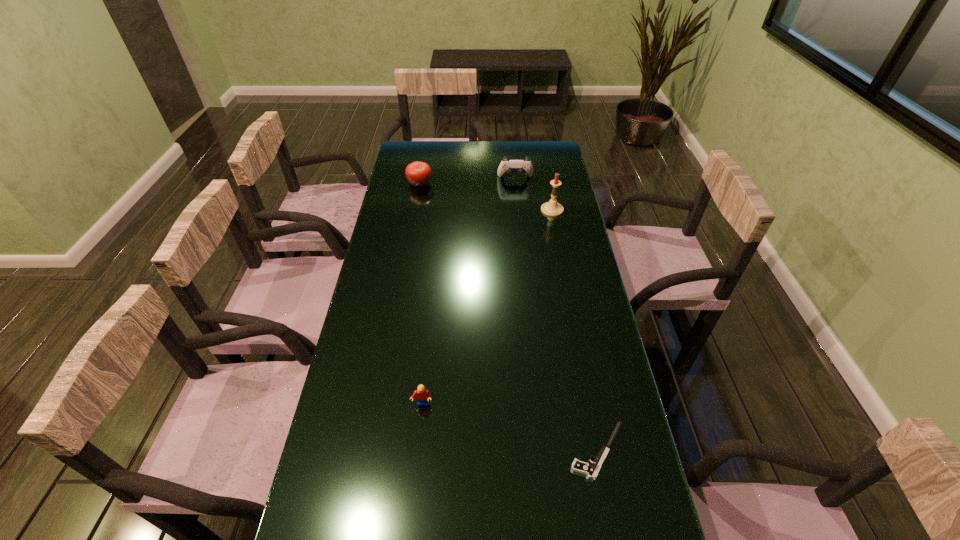
Identify the location of free location located 0.120m on the front-facing side of the control. [x=517, y=199].

Locate an element on the screen. vacant area situated 0.160m on the front-facing side of the Lego is located at coordinates (416, 471).

You are a GUI agent. You are given a task and a screenshot of the screen. Output one action in this format:
    pyautogui.click(x=<x>, y=<y>)
    Task: Click on the vacant region located on the front-facing side of the nearest object
    The image size is (960, 540).
    Given the screenshot: What is the action you would take?
    pyautogui.click(x=519, y=451)

You are a GUI agent. You are given a task and a screenshot of the screen. Output one action in this format:
    pyautogui.click(x=<x>, y=<y>)
    Task: Click on the free space located 0.260m on the front-facing side of the nearest object
    The image size is (960, 540).
    Given the screenshot: What is the action you would take?
    coord(462,451)

This screenshot has width=960, height=540. Identify the location of free space located on the front-facing side of the nearest object. (548, 451).

The width and height of the screenshot is (960, 540). What are the coordinates of `object that is at the left edge` in the screenshot? It's located at (418, 173).

Where is `candle that is at the right edge`? This screenshot has width=960, height=540. candle that is at the right edge is located at coordinates (552, 208).

Identify the location of control situated at the right edge. tap(509, 166).

The height and width of the screenshot is (540, 960). What are the coordinates of `pistol that is at the right edge` in the screenshot? It's located at (591, 471).

This screenshot has width=960, height=540. In order to click on vacant space at the far edge of the desktop in this screenshot , I will do `click(483, 160)`.